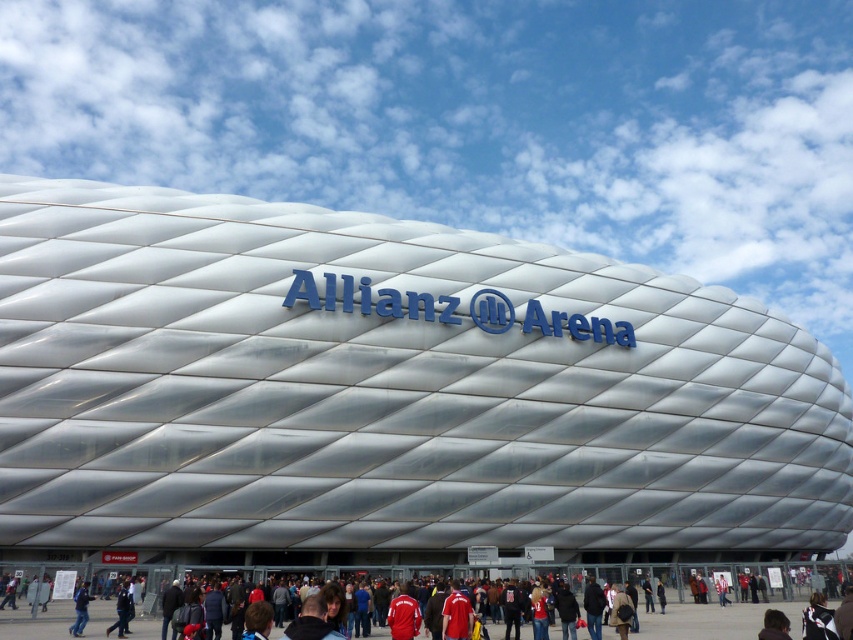
Question: Among these objects, which one is nearest to the camera?

Choices:
 (A) blue fabric jacket at lower left
 (B) red fabric jacket at center

Answer: (B)

Question: Which point is farther to the camera?

Choices:
 (A) (78, 608)
 (B) (160, 596)

Answer: (B)

Question: Is red fabric jacket at center thinner than blue fabric jacket at lower left?

Choices:
 (A) yes
 (B) no

Answer: (B)

Question: Where is red fabric jacket at center located in relation to blue fabric jacket at lower left in the image?

Choices:
 (A) below
 (B) above

Answer: (A)

Question: Can you confirm if red fabric jacket at center is positioned to the right of blue fabric jacket at lower left?

Choices:
 (A) no
 (B) yes

Answer: (B)

Question: Which point is farther to the camera?

Choices:
 (A) blue fabric jacket at lower left
 (B) red fabric jacket at center

Answer: (A)